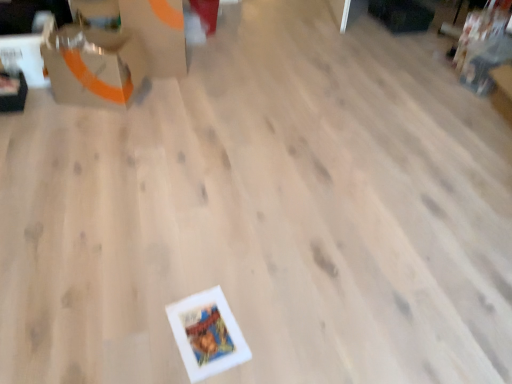
Describe the element at coordinates (158, 33) in the screenshot. I see `matte orange cardboard box at upper left, which is the 2th cardboard box from bottom to top` at that location.

Where is `matte orange cardboard box at upper left, placed as the 1th cardboard box when sorted from top to bottom`? The height and width of the screenshot is (384, 512). matte orange cardboard box at upper left, placed as the 1th cardboard box when sorted from top to bottom is located at coordinates (158, 33).

What do you see at coordinates (92, 65) in the screenshot? This screenshot has width=512, height=384. I see `matte cardboard box at upper left, which is the 1th cardboard box in bottom-to-top order` at bounding box center [92, 65].

How much space does matte cardboard box at upper left, which is the 1th cardboard box in bottom-to-top order, occupy horizontally?

matte cardboard box at upper left, which is the 1th cardboard box in bottom-to-top order, is 12.50 inches in width.

Identify the location of matte cardboard box at upper left, the second cardboard box positioned from the top. click(92, 65).

Where is `matte orange cardboard box at upper left, placed as the 1th cardboard box when sorted from top to bottom`? matte orange cardboard box at upper left, placed as the 1th cardboard box when sorted from top to bottom is located at coordinates (158, 33).

Looking at this image, between matte orange cardboard box at upper left, placed as the 1th cardboard box when sorted from top to bottom, and matte cardboard box at upper left, which is the 1th cardboard box in bottom-to-top order, which one appears on the right side from the viewer's perspective?

Positioned to the right is matte orange cardboard box at upper left, placed as the 1th cardboard box when sorted from top to bottom.

In the image, is matte orange cardboard box at upper left, placed as the 1th cardboard box when sorted from top to bottom, positioned in front of or behind matte cardboard box at upper left, the second cardboard box positioned from the top?

Visually, matte orange cardboard box at upper left, placed as the 1th cardboard box when sorted from top to bottom, is located behind matte cardboard box at upper left, the second cardboard box positioned from the top.

Which point is more forward, (168,39) or (93,100)?

Point (93,100)

From the image's perspective, which one is positioned higher, matte orange cardboard box at upper left, which is the 2th cardboard box from bottom to top, or matte cardboard box at upper left, the second cardboard box positioned from the top?

matte orange cardboard box at upper left, which is the 2th cardboard box from bottom to top, from the image's perspective.

From a real-world perspective, is matte orange cardboard box at upper left, placed as the 1th cardboard box when sorted from top to bottom, located higher than matte cardboard box at upper left, which is the 1th cardboard box in bottom-to-top order?

Yes, from a real-world perspective, matte orange cardboard box at upper left, placed as the 1th cardboard box when sorted from top to bottom, is above matte cardboard box at upper left, which is the 1th cardboard box in bottom-to-top order.

Considering the sizes of objects matte orange cardboard box at upper left, which is the 2th cardboard box from bottom to top, and matte cardboard box at upper left, the second cardboard box positioned from the top, in the image provided, who is wider, matte orange cardboard box at upper left, which is the 2th cardboard box from bottom to top, or matte cardboard box at upper left, the second cardboard box positioned from the top,?

matte orange cardboard box at upper left, which is the 2th cardboard box from bottom to top, is wider.

Between matte orange cardboard box at upper left, which is the 2th cardboard box from bottom to top, and matte cardboard box at upper left, which is the 1th cardboard box in bottom-to-top order, which one has more height?

With more height is matte orange cardboard box at upper left, which is the 2th cardboard box from bottom to top.

Is matte orange cardboard box at upper left, which is the 2th cardboard box from bottom to top, bigger than matte cardboard box at upper left, which is the 1th cardboard box in bottom-to-top order?

Yes.

Is matte orange cardboard box at upper left, placed as the 1th cardboard box when sorted from top to bottom, positioned beyond the bounds of matte cardboard box at upper left, the second cardboard box positioned from the top?

matte orange cardboard box at upper left, placed as the 1th cardboard box when sorted from top to bottom, lies outside matte cardboard box at upper left, the second cardboard box positioned from the top,'s area.

Would you say matte orange cardboard box at upper left, placed as the 1th cardboard box when sorted from top to bottom, is a long distance from matte cardboard box at upper left, which is the 1th cardboard box in bottom-to-top order?

No.

Is matte orange cardboard box at upper left, which is the 2th cardboard box from bottom to top, oriented towards matte cardboard box at upper left, which is the 1th cardboard box in bottom-to-top order?

No, matte orange cardboard box at upper left, which is the 2th cardboard box from bottom to top, does not turn towards matte cardboard box at upper left, which is the 1th cardboard box in bottom-to-top order.

How different are the orientations of matte orange cardboard box at upper left, which is the 2th cardboard box from bottom to top, and matte cardboard box at upper left, the second cardboard box positioned from the top, in degrees?

The facing directions of matte orange cardboard box at upper left, which is the 2th cardboard box from bottom to top, and matte cardboard box at upper left, the second cardboard box positioned from the top, are 19.6 degrees apart.

I want to click on cardboard box that appears on the left of matte orange cardboard box at upper left, placed as the 1th cardboard box when sorted from top to bottom, so click(x=92, y=65).

Considering the relative positions of matte cardboard box at upper left, the second cardboard box positioned from the top, and matte orange cardboard box at upper left, which is the 2th cardboard box from bottom to top, in the image provided, is matte cardboard box at upper left, the second cardboard box positioned from the top, to the right of matte orange cardboard box at upper left, which is the 2th cardboard box from bottom to top, from the viewer's perspective?

Incorrect, matte cardboard box at upper left, the second cardboard box positioned from the top, is not on the right side of matte orange cardboard box at upper left, which is the 2th cardboard box from bottom to top.

Between matte cardboard box at upper left, the second cardboard box positioned from the top, and matte orange cardboard box at upper left, placed as the 1th cardboard box when sorted from top to bottom, which one is positioned in front?

matte cardboard box at upper left, the second cardboard box positioned from the top, is in front.

Does point (106, 76) appear closer or farther from the camera than point (155, 63)?

Point (106, 76).

From the image's perspective, which object appears higher, matte cardboard box at upper left, the second cardboard box positioned from the top, or matte orange cardboard box at upper left, placed as the 1th cardboard box when sorted from top to bottom?

matte orange cardboard box at upper left, placed as the 1th cardboard box when sorted from top to bottom, from the image's perspective.

In the scene shown: From a real-world perspective, between matte cardboard box at upper left, the second cardboard box positioned from the top, and matte orange cardboard box at upper left, placed as the 1th cardboard box when sorted from top to bottom, who is vertically lower?

From a 3D spatial view, matte cardboard box at upper left, the second cardboard box positioned from the top, is below.

Which of these two, matte cardboard box at upper left, the second cardboard box positioned from the top, or matte orange cardboard box at upper left, which is the 2th cardboard box from bottom to top, is thinner?

Thinner between the two is matte cardboard box at upper left, the second cardboard box positioned from the top.

Does matte cardboard box at upper left, the second cardboard box positioned from the top, have a greater height compared to matte orange cardboard box at upper left, which is the 2th cardboard box from bottom to top?

No.

Based on their sizes in the image, would you say matte cardboard box at upper left, which is the 1th cardboard box in bottom-to-top order, is bigger or smaller than matte orange cardboard box at upper left, which is the 2th cardboard box from bottom to top?

matte cardboard box at upper left, which is the 1th cardboard box in bottom-to-top order, is smaller than matte orange cardboard box at upper left, which is the 2th cardboard box from bottom to top.

Is matte orange cardboard box at upper left, placed as the 1th cardboard box when sorted from top to bottom, located within matte cardboard box at upper left, the second cardboard box positioned from the top?

No, matte orange cardboard box at upper left, placed as the 1th cardboard box when sorted from top to bottom, is located outside of matte cardboard box at upper left, the second cardboard box positioned from the top.

Is matte cardboard box at upper left, which is the 1th cardboard box in bottom-to-top order, placed right next to matte orange cardboard box at upper left, which is the 2th cardboard box from bottom to top?

They are not placed beside each other.

Could you tell me if matte cardboard box at upper left, the second cardboard box positioned from the top, is turned towards matte orange cardboard box at upper left, placed as the 1th cardboard box when sorted from top to bottom?

No, matte cardboard box at upper left, the second cardboard box positioned from the top, is not facing towards matte orange cardboard box at upper left, placed as the 1th cardboard box when sorted from top to bottom.

How many degrees apart are the facing directions of matte cardboard box at upper left, the second cardboard box positioned from the top, and matte orange cardboard box at upper left, placed as the 1th cardboard box when sorted from top to bottom?

The angular difference between matte cardboard box at upper left, the second cardboard box positioned from the top, and matte orange cardboard box at upper left, placed as the 1th cardboard box when sorted from top to bottom, is 19.6 degrees.

At what (x,y) coordinates should I click in order to perform the action: click on cardboard box in front of the matte orange cardboard box at upper left, placed as the 1th cardboard box when sorted from top to bottom. Please return your answer as a coordinate pair (x, y). This screenshot has height=384, width=512. Looking at the image, I should click on [92, 65].

Image resolution: width=512 pixels, height=384 pixels. In order to click on cardboard box that is above the matte cardboard box at upper left, the second cardboard box positioned from the top (from a real-world perspective) in this screenshot , I will do `click(158, 33)`.

Image resolution: width=512 pixels, height=384 pixels. I want to click on cardboard box on the left of matte orange cardboard box at upper left, which is the 2th cardboard box from bottom to top, so click(x=92, y=65).